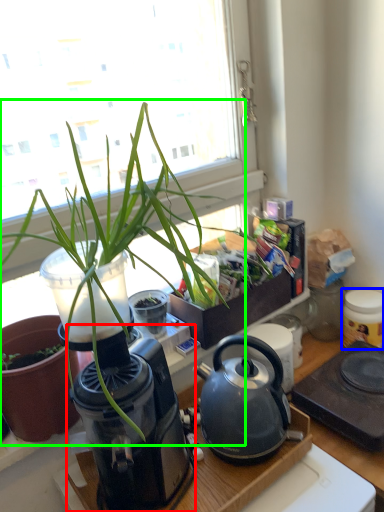
Question: Which is farther away from coffee machine (highlighted by a red box)? appliance (highlighted by a blue box) or houseplant (highlighted by a green box)?

Choices:
 (A) appliance
 (B) houseplant

Answer: (A)